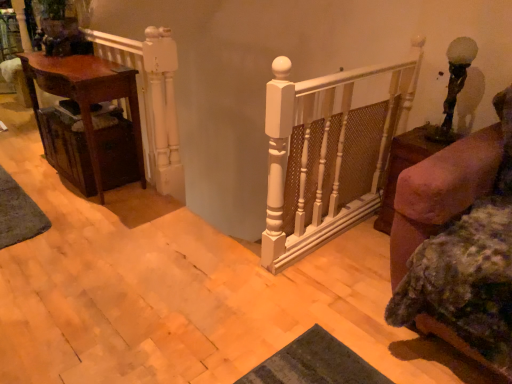
Locate an element on the screen. This screenshot has height=384, width=512. vacant region to the left of woven brown drawer at left is located at coordinates click(x=31, y=171).